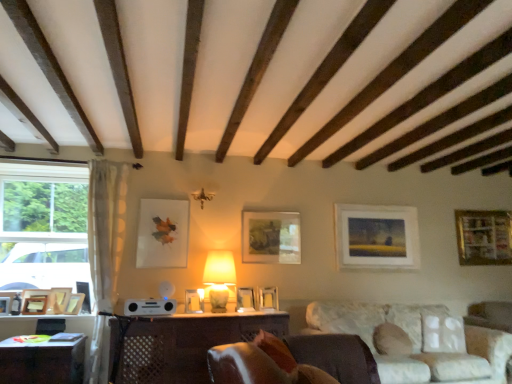
Question: Can you confirm if wooden table at lower left, which ranks as the 1th table in left-to-right order, is positioned to the left of wooden picture frame at right, the 1th picture frame viewed from the right?

Choices:
 (A) no
 (B) yes

Answer: (B)

Question: Is wooden table at lower left, which ranks as the 1th table in left-to-right order, smaller than wooden picture frame at right, the 1th picture frame viewed from the right?

Choices:
 (A) no
 (B) yes

Answer: (A)

Question: Can you confirm if wooden table at lower left, which ranks as the 1th table in left-to-right order, is bigger than wooden picture frame at right, the 1th picture frame viewed from the right?

Choices:
 (A) yes
 (B) no

Answer: (A)

Question: Is wooden table at lower left, which ranks as the 1th table in left-to-right order, not within wooden picture frame at right, the 1th picture frame viewed from the right?

Choices:
 (A) no
 (B) yes

Answer: (B)

Question: Is wooden table at lower left, which is the 2th table from right to left, oriented towards wooden picture frame at right, the 1th picture frame viewed from the right?

Choices:
 (A) no
 (B) yes

Answer: (A)

Question: From a real-world perspective, relative to wooden photo frame at left, which ranks as the first picture frame in left-to-right order, is satin silver speaker at center vertically above or below?

Choices:
 (A) below
 (B) above

Answer: (B)

Question: In terms of width, does satin silver speaker at center look wider or thinner when compared to wooden photo frame at left, acting as the twelfth picture frame starting from the right?

Choices:
 (A) thin
 (B) wide

Answer: (B)

Question: Would you say satin silver speaker at center is inside or outside wooden photo frame at left, which ranks as the first picture frame in left-to-right order?

Choices:
 (A) outside
 (B) inside

Answer: (A)

Question: From their relative heights in the image, would you say satin silver speaker at center is taller or shorter than wooden photo frame at left, which ranks as the first picture frame in left-to-right order?

Choices:
 (A) tall
 (B) short

Answer: (B)

Question: Does point (119, 196) appear closer or farther from the camera than point (36, 302)?

Choices:
 (A) farther
 (B) closer

Answer: (A)

Question: Is white sheer curtain at left inside or outside of wooden picture frame at lower left, the 2th picture frame positioned from the left?

Choices:
 (A) outside
 (B) inside

Answer: (A)

Question: Relative to wooden picture frame at lower left, the 2th picture frame positioned from the left, is white sheer curtain at left in front or behind?

Choices:
 (A) front
 (B) behind

Answer: (A)

Question: Is white sheer curtain at left wider or thinner than wooden picture frame at lower left, the 2th picture frame positioned from the left?

Choices:
 (A) thin
 (B) wide

Answer: (B)

Question: Is matte white picture frame at center right, placed as the second picture frame when sorted from right to left, taller or shorter than matte beige lamp at center?

Choices:
 (A) short
 (B) tall

Answer: (B)

Question: From the image's perspective, relative to matte beige lamp at center, is matte white picture frame at center right, placed as the second picture frame when sorted from right to left, above or below?

Choices:
 (A) below
 (B) above

Answer: (B)